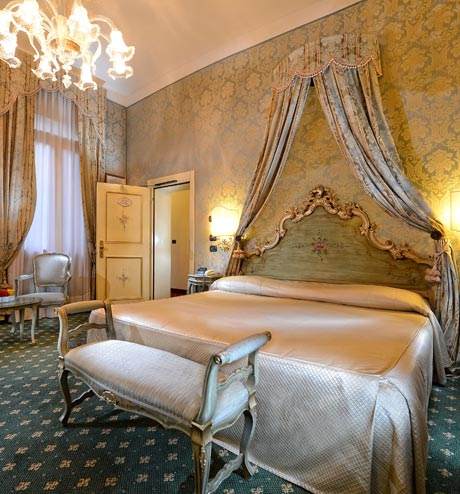
Locate an element on the screen. 1 bed is located at coordinates (361, 361).